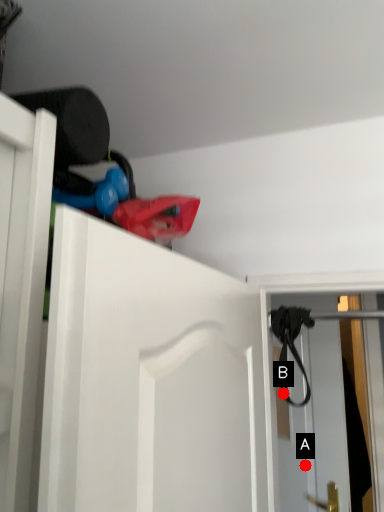
Question: Two points are circled on the image, labeled by A and B beside each circle. Which point is further to the camera?

Choices:
 (A) A is further
 (B) B is further

Answer: (A)